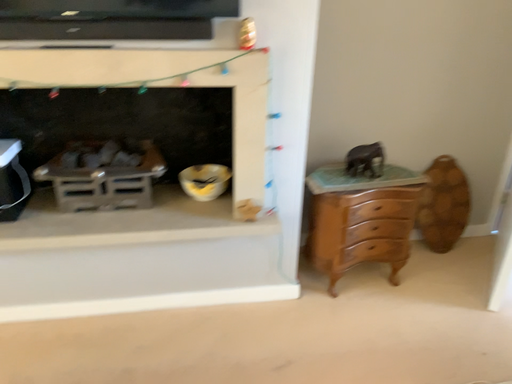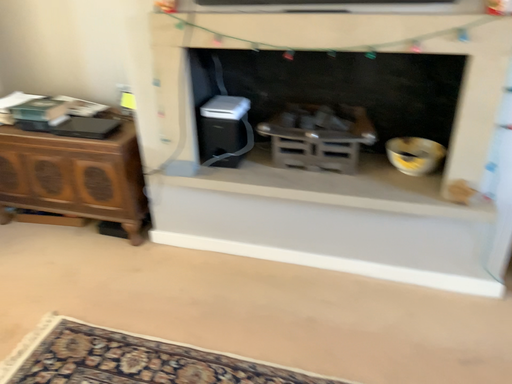
Question: How did the camera likely rotate when shooting the video?

Choices:
 (A) rotated left
 (B) rotated right

Answer: (A)